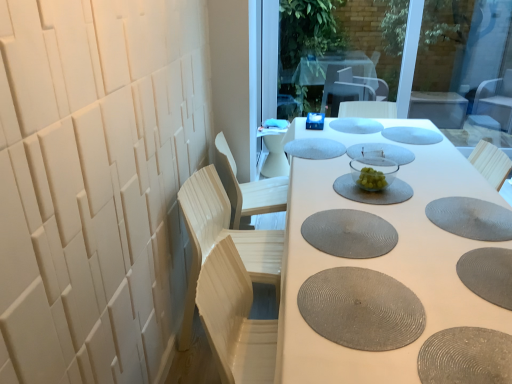
This screenshot has width=512, height=384. What are the coordinates of `unoccupied space behind clear glass bowl at center, which is the fourth manhole cover in back-to-front order` in the screenshot? It's located at (348, 135).